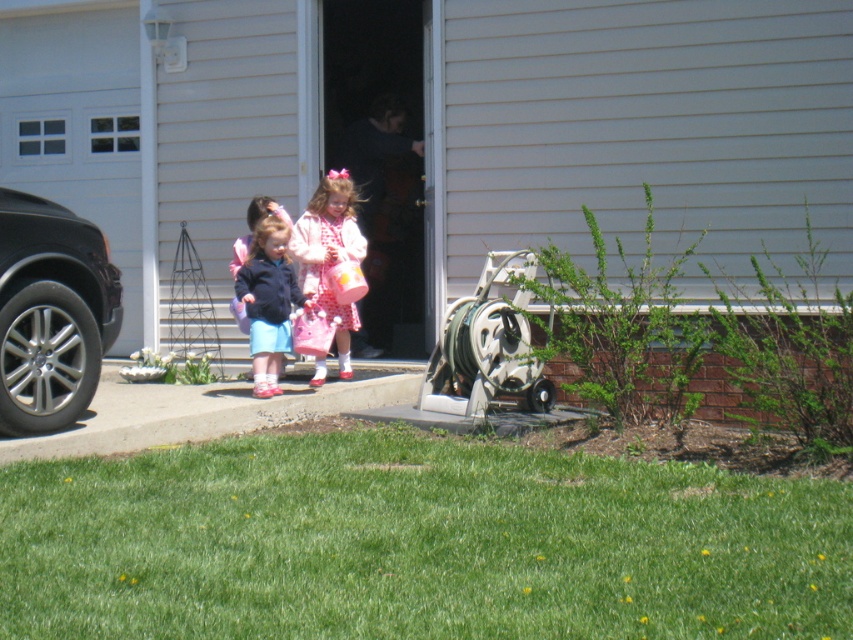
Question: Which point is closer to the camera?

Choices:
 (A) (74, 394)
 (B) (276, 355)

Answer: (A)

Question: Does shiny black car at left come in front of matte blue jacket at center?

Choices:
 (A) no
 (B) yes

Answer: (B)

Question: Is metallic gray hose reel at lower center to the right of pink satin dress at center from the viewer's perspective?

Choices:
 (A) yes
 (B) no

Answer: (A)

Question: Which point is closer to the camera?

Choices:
 (A) pink satin dress at center
 (B) matte blue jacket at center
 (C) metallic gray hose reel at lower center
 (D) shiny black car at left

Answer: (D)

Question: Does shiny black car at left have a larger size compared to pink satin dress at center?

Choices:
 (A) yes
 (B) no

Answer: (A)

Question: Which object is the farthest from the matte blue jacket at center?

Choices:
 (A) pink satin dress at center
 (B) metallic gray hose reel at lower center

Answer: (B)